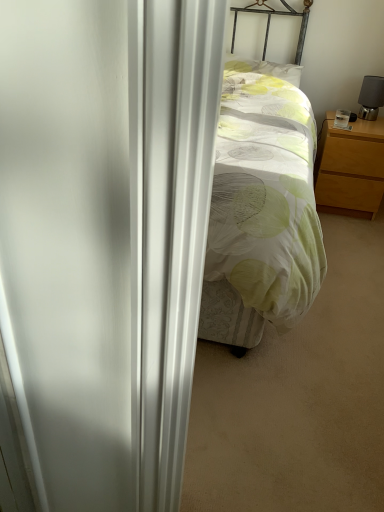
Question: From the image's perspective, is light wood/finish nightstand at right located above or below black matte table lamp at right?

Choices:
 (A) below
 (B) above

Answer: (A)

Question: Is light wood/finish nightstand at right taller or shorter than black matte table lamp at right?

Choices:
 (A) tall
 (B) short

Answer: (A)

Question: Based on their relative distances, which object is farther from the light green fabric pillow at center?

Choices:
 (A) light wood/finish nightstand at right
 (B) black matte table lamp at right

Answer: (A)

Question: Estimate the real-world distances between objects in this image. Which object is closer to the light green fabric pillow at center?

Choices:
 (A) light wood/finish nightstand at right
 (B) black matte table lamp at right

Answer: (B)